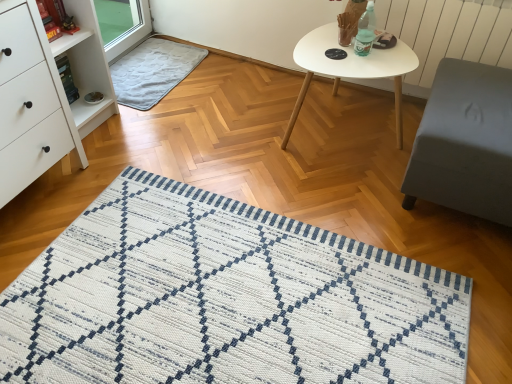
At what (x,y) coordinates should I click in order to perform the action: click on spots to the right of gray soft rug at upper left. Please return your answer as a coordinate pair (x, y). The width and height of the screenshot is (512, 384). Looking at the image, I should click on (228, 89).